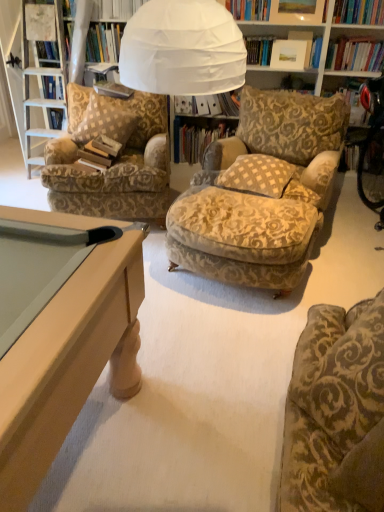
Question: Is patterned fabric armchair at left, the first chair viewed from the left, bigger than white paper book at center, the third book viewed from the front?

Choices:
 (A) no
 (B) yes

Answer: (B)

Question: Considering the relative sizes of patterned fabric armchair at left, the first chair when ordered from back to front, and white paper book at center, the third book viewed from the front, in the image provided, is patterned fabric armchair at left, the first chair when ordered from back to front, wider than white paper book at center, the third book viewed from the front,?

Choices:
 (A) no
 (B) yes

Answer: (B)

Question: Does patterned fabric armchair at left, the first chair when ordered from back to front, have a lesser height compared to white paper book at center, the third book viewed from the front?

Choices:
 (A) yes
 (B) no

Answer: (B)

Question: Can white paper book at center, placed as the second book when sorted from back to front, be found inside patterned fabric armchair at left, which is the 2th chair from front to back?

Choices:
 (A) yes
 (B) no

Answer: (B)

Question: Does patterned fabric armchair at left, placed as the second chair when sorted from bottom to top, appear on the right side of white paper book at center, placed as the second book when sorted from back to front?

Choices:
 (A) yes
 (B) no

Answer: (B)

Question: Is patterned fabric armchair at left, the 2th chair from the right, outside white paper book at center, placed as the second book when sorted from back to front?

Choices:
 (A) no
 (B) yes

Answer: (B)

Question: Can you confirm if white paper book at center, placed as the second book when sorted from back to front, is shorter than hardcover book at center, which is counted as the 3th book, starting from the back?

Choices:
 (A) yes
 (B) no

Answer: (B)

Question: Is hardcover book at center, the 2th book when ordered from front to back, at the back of white paper book at center, the third book viewed from the front?

Choices:
 (A) yes
 (B) no

Answer: (B)

Question: Does white paper book at center, the third book viewed from the front, appear on the left side of hardcover book at center, the 2th book when ordered from front to back?

Choices:
 (A) yes
 (B) no

Answer: (B)

Question: Considering the relative sizes of white paper book at center, the third book viewed from the front, and hardcover book at center, which is counted as the 3th book, starting from the back, in the image provided, is white paper book at center, the third book viewed from the front, thinner than hardcover book at center, which is counted as the 3th book, starting from the back,?

Choices:
 (A) yes
 (B) no

Answer: (B)

Question: Is white paper book at center, placed as the second book when sorted from back to front, touching hardcover book at center, the 2th book when ordered from front to back?

Choices:
 (A) no
 (B) yes

Answer: (A)

Question: Is white paper book at center, the third book viewed from the front, positioned behind hardcover book at center, which is counted as the 3th book, starting from the back?

Choices:
 (A) no
 (B) yes

Answer: (B)

Question: From the image's perspective, is velvet gold-patterned chair at lower right, which is the 2th chair from left to right, below patterned fabric armchair at left, the first chair viewed from the left?

Choices:
 (A) no
 (B) yes

Answer: (B)